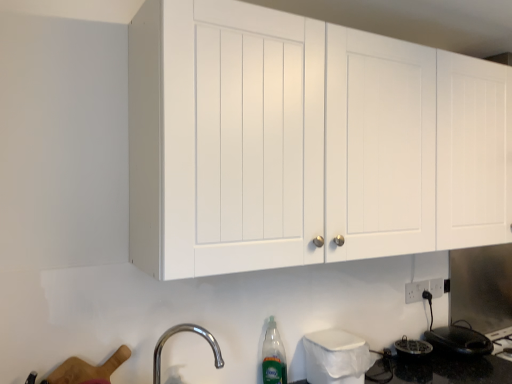
Question: Is chrome metallic faucet at lower left facing towards translucent plastic bottle at lower center?

Choices:
 (A) yes
 (B) no

Answer: (B)

Question: Considering the relative positions of chrome metallic faucet at lower left and translucent plastic bottle at lower center in the image provided, is chrome metallic faucet at lower left behind translucent plastic bottle at lower center?

Choices:
 (A) no
 (B) yes

Answer: (A)

Question: Is chrome metallic faucet at lower left oriented away from translucent plastic bottle at lower center?

Choices:
 (A) no
 (B) yes

Answer: (A)

Question: Considering the relative positions of chrome metallic faucet at lower left and translucent plastic bottle at lower center in the image provided, is chrome metallic faucet at lower left in front of translucent plastic bottle at lower center?

Choices:
 (A) yes
 (B) no

Answer: (A)

Question: Can we say chrome metallic faucet at lower left lies outside translucent plastic bottle at lower center?

Choices:
 (A) yes
 (B) no

Answer: (A)

Question: Looking at the image, does chrome metallic faucet at lower left seem bigger or smaller compared to white matte cabinet at upper center?

Choices:
 (A) big
 (B) small

Answer: (B)

Question: Considering the positions of point (188, 327) and point (159, 56), is point (188, 327) closer or farther from the camera than point (159, 56)?

Choices:
 (A) farther
 (B) closer

Answer: (A)

Question: Based on their positions, is chrome metallic faucet at lower left located to the left or right of white matte cabinet at upper center?

Choices:
 (A) left
 (B) right

Answer: (A)

Question: Considering their positions, is chrome metallic faucet at lower left located in front of or behind white matte cabinet at upper center?

Choices:
 (A) front
 (B) behind

Answer: (B)

Question: From a real-world perspective, relative to black glossy electric kettle at lower right, which ranks as the first appliance in back-to-front order, is white matte cabinet at upper center vertically above or below?

Choices:
 (A) below
 (B) above

Answer: (B)

Question: Looking at their shapes, would you say white matte cabinet at upper center is wider or thinner than black glossy electric kettle at lower right, which appears as the first appliance when viewed from the right?

Choices:
 (A) thin
 (B) wide

Answer: (B)

Question: Visually, is white matte cabinet at upper center positioned to the left or to the right of black glossy electric kettle at lower right, arranged as the 2th appliance when viewed from the front?

Choices:
 (A) left
 (B) right

Answer: (A)

Question: Considering their positions, is white matte cabinet at upper center located in front of or behind black glossy electric kettle at lower right, which appears as the first appliance when viewed from the right?

Choices:
 (A) behind
 (B) front

Answer: (B)

Question: Looking at their shapes, would you say translucent plastic bottle at lower center is wider or thinner than black glossy electric kettle at lower right, which ranks as the first appliance in back-to-front order?

Choices:
 (A) thin
 (B) wide

Answer: (A)

Question: In the image, is translucent plastic bottle at lower center positioned in front of or behind black glossy electric kettle at lower right, arranged as the 2th appliance when viewed from the front?

Choices:
 (A) behind
 (B) front

Answer: (B)